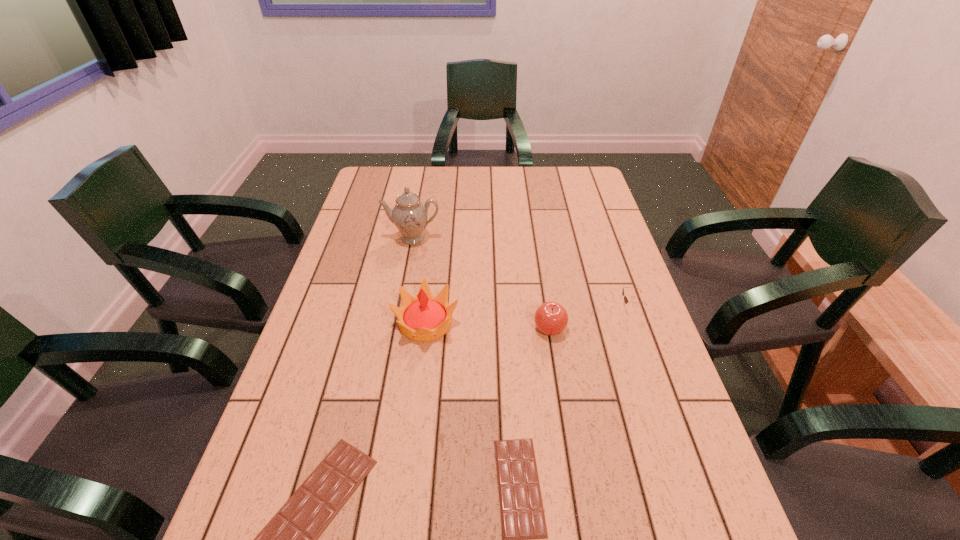
At what (x,y) coordinates should I click in order to perform the action: click on the farthest object. Please return your answer as a coordinate pair (x, y). The image size is (960, 540). Looking at the image, I should click on (409, 215).

You are a GUI agent. You are given a task and a screenshot of the screen. Output one action in this format:
    pyautogui.click(x=<x>, y=<y>)
    Task: Click on the chinaware
    Image resolution: width=960 pixels, height=540 pixels.
    Given the screenshot: What is the action you would take?
    pyautogui.click(x=409, y=215)

The width and height of the screenshot is (960, 540). Find the location of `the second object from right to left`. the second object from right to left is located at coordinates (551, 318).

Locate an element on the screen. apple is located at coordinates (551, 318).

At what (x,y) coordinates should I click in order to perform the action: click on the third shortest object. Please return your answer as a coordinate pair (x, y). The width and height of the screenshot is (960, 540). Looking at the image, I should click on click(x=626, y=301).

At what (x,y) coordinates should I click in order to perform the action: click on sunglasses. Please return your answer as a coordinate pair (x, y). Image resolution: width=960 pixels, height=540 pixels. Looking at the image, I should click on (626, 301).

At what (x,y) coordinates should I click in order to perform the action: click on the second tallest object. Please return your answer as a coordinate pair (x, y). Looking at the image, I should click on (425, 318).

You are a GUI agent. You are given a task and a screenshot of the screen. Output one action in this format:
    pyautogui.click(x=<x>, y=<y>)
    Task: Click on the vacant position located on the spout of the tallest object
    The height and width of the screenshot is (540, 960).
    Given the screenshot: What is the action you would take?
    pyautogui.click(x=401, y=295)

Find the location of `free location located on the front of the fifth object from left to right`. free location located on the front of the fifth object from left to right is located at coordinates tap(560, 393).

Where is `vacant space located 0.260m in front of the lenses of the sunglasses`? The width and height of the screenshot is (960, 540). vacant space located 0.260m in front of the lenses of the sunglasses is located at coordinates (523, 308).